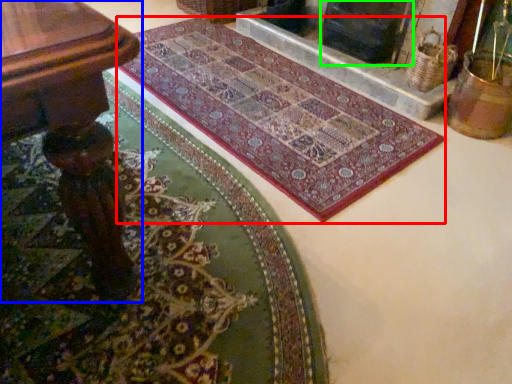
Question: Which object is positioned closest to mat (highlighted by a red box)? Select from table (highlighted by a blue box) and fireplace (highlighted by a green box).

Choices:
 (A) table
 (B) fireplace

Answer: (B)